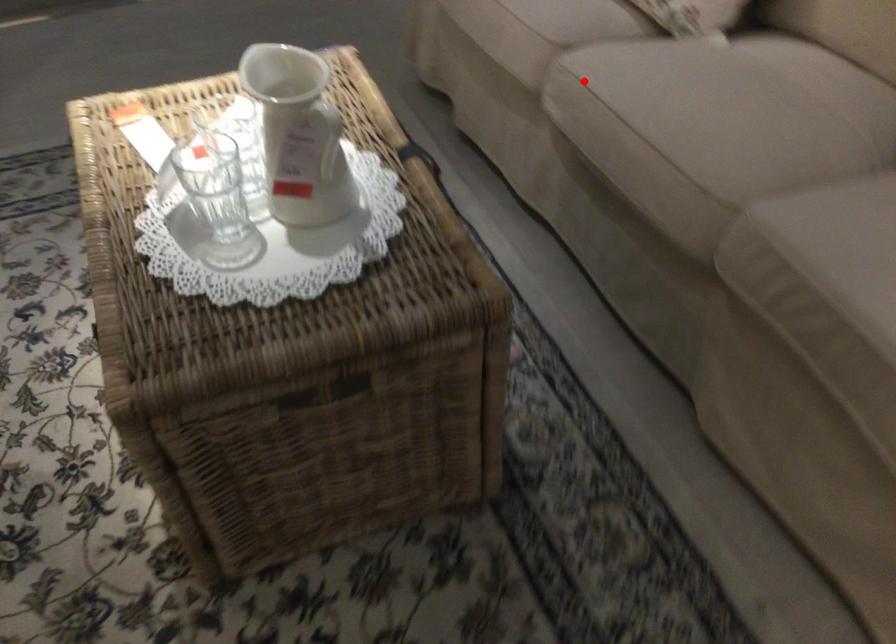
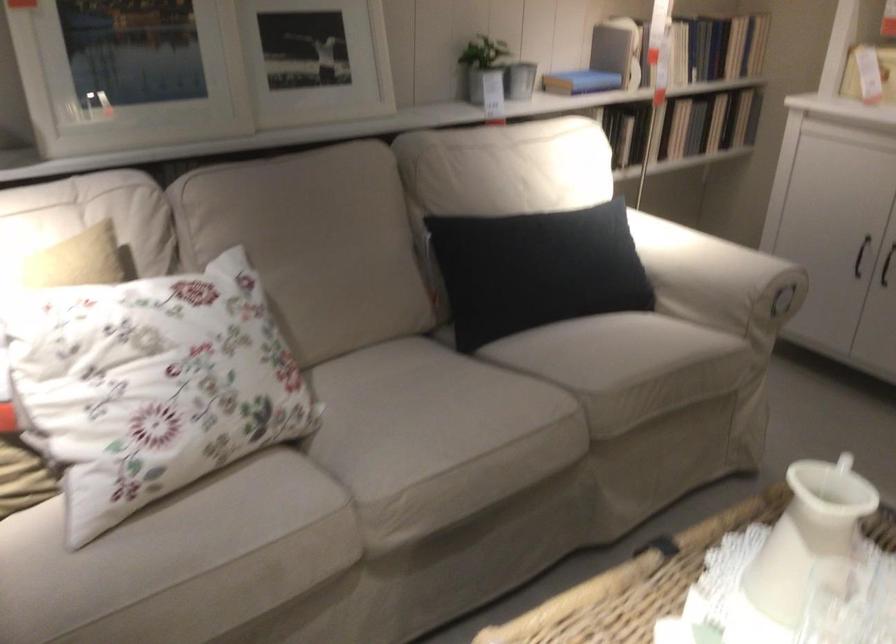
Locate, in the second image, the point that corresponds to the highlighted location in the first image.

(398, 494)